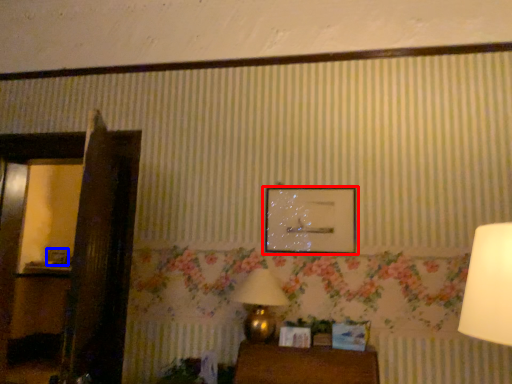
Question: Which of the following is the closest to the observer, picture frame (highlighted by a red box) or picture frame (highlighted by a blue box)?

Choices:
 (A) picture frame
 (B) picture frame

Answer: (A)